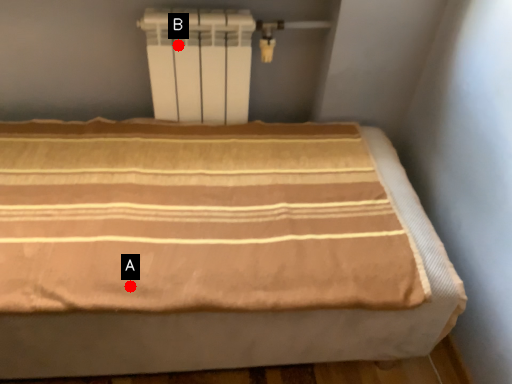
Question: Two points are circled on the image, labeled by A and B beside each circle. Which point appears closest to the camera in this image?

Choices:
 (A) A is closer
 (B) B is closer

Answer: (A)